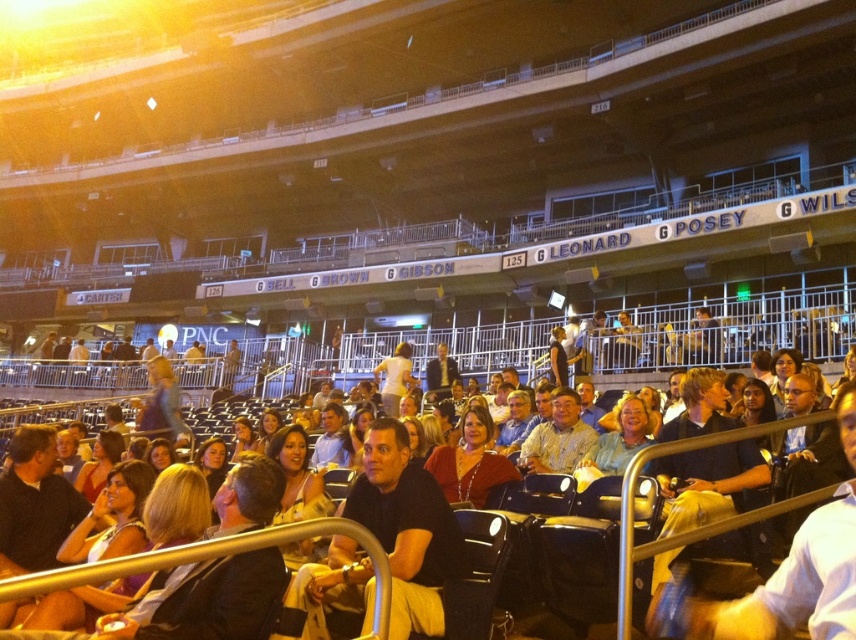
You are sitting in the arena and notice two points marked on the floor. The first point is at coordinates point (479, 492) and the second is at point (316, 445). Which point is closer to you?

Point (479, 492) is closer to the viewer than point (316, 445).

You are a photographer standing at the edge of the arena floor, and you want to capture both the dark blue shirt at center and the matte red sweater at center in a single shot. The camera you are using has a maximum focus range of 10 feet. Will you be able to fit both subjects into the frame without moving closer?

The distance between the dark blue shirt at center and the matte red sweater at center is 9.64 feet, which is within the camera maximum focus range of 10 feet. Therefore, you can fit both subjects into the frame without moving closer.

You are an attendee at the event and want to take a photo of the two people in front of you. The two people are wearing a matte red sweater at center and have light brown hair at center. You need to ensure that both the sweater and the hair are clearly visible in the photo. Considering their heights, which one should you focus on first to make sure both are in focus?

The matte red sweater at center is taller than the light brown hair at center. To ensure both are in focus, focus on the matte red sweater at center first since it is taller and will likely be in the background, requiring proper focus adjustment.